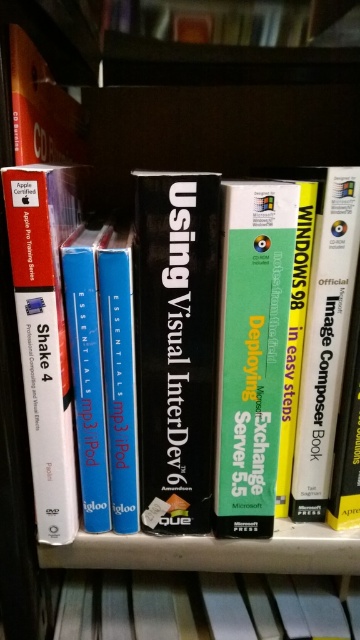
Question: Does black matte book at center appear on the right side of matte white book at left?

Choices:
 (A) no
 (B) yes

Answer: (B)

Question: Is green matte book at center smaller than yellow paper at center?

Choices:
 (A) yes
 (B) no

Answer: (A)

Question: Which point is closer to the camera?

Choices:
 (A) (257, 452)
 (B) (10, 228)
 (C) (110, 257)

Answer: (B)

Question: Among these objects, which one is farthest from the camera?

Choices:
 (A) yellow paper at center
 (B) blue glossy mp3 ipod at center

Answer: (A)

Question: Is green matte book at center positioned at the back of yellow paper at center?

Choices:
 (A) yes
 (B) no

Answer: (B)

Question: Among these points, which one is nearest to the camera?

Choices:
 (A) (214, 499)
 (B) (128, 449)
 (C) (160, 400)

Answer: (C)